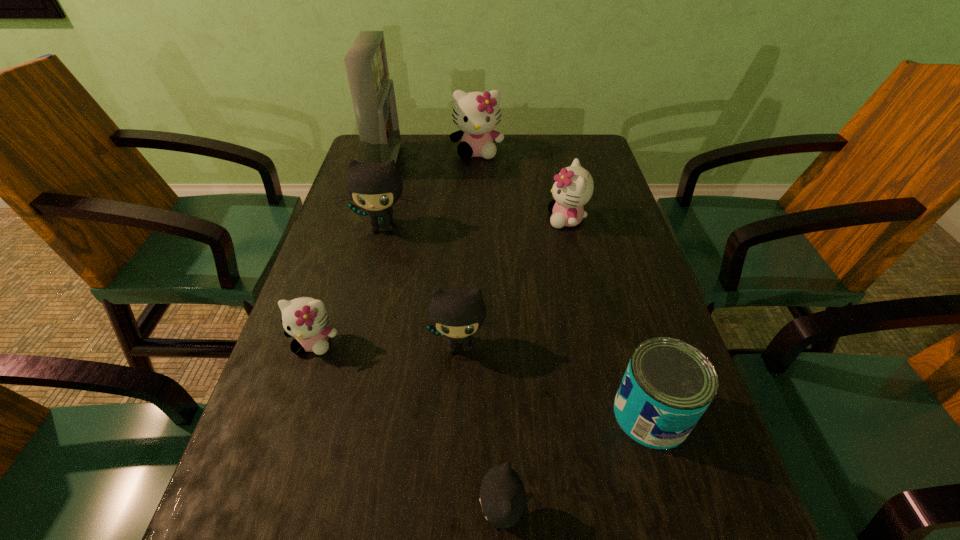
The width and height of the screenshot is (960, 540). In order to click on blank space at the right edge of the desktop in this screenshot , I will do `click(577, 239)`.

In the image, there is a desktop. Where is `vacant space at the far right corner`? vacant space at the far right corner is located at coordinates (597, 166).

Find the location of `free space between the blue can and the biggest gray kitten`. free space between the blue can and the biggest gray kitten is located at coordinates (516, 320).

Where is `free space between the leftmost gray kitten and the smallest white kitten`? free space between the leftmost gray kitten and the smallest white kitten is located at coordinates (348, 285).

Where is `free space between the second smallest white kitten and the blue can`? free space between the second smallest white kitten and the blue can is located at coordinates (609, 317).

Image resolution: width=960 pixels, height=540 pixels. Identify the location of free area in between the can and the biggest gray kitten. (516, 320).

The width and height of the screenshot is (960, 540). Find the location of `empty location between the farthest gray kitten and the second farthest gray kitten`. empty location between the farthest gray kitten and the second farthest gray kitten is located at coordinates (421, 286).

The height and width of the screenshot is (540, 960). In order to click on empty space between the blue can and the first-aid kit in this screenshot , I will do `click(518, 288)`.

Select which object appears as the closest to the farthest white kitten. Please provide its 2D coordinates. Your answer should be formatted as a tuple, i.e. [(x, y)], where the tuple contains the x and y coordinates of a point satisfying the conditions above.

[(372, 92)]

Point out which object is positioned as the fourth nearest to the nearest object. Please provide its 2D coordinates. Your answer should be formatted as a tuple, i.e. [(x, y)], where the tuple contains the x and y coordinates of a point satisfying the conditions above.

[(374, 186)]